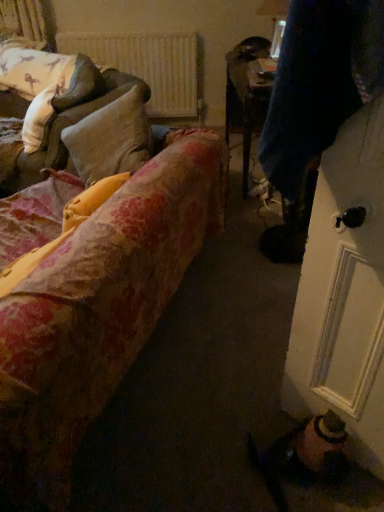
Question: From the image's perspective, would you say velvet dark blue coat at right is positioned over floral fabric couch at left, the first studio couch positioned from the back?

Choices:
 (A) no
 (B) yes

Answer: (B)

Question: Is velvet dark blue coat at right positioned in front of floral fabric couch at left, the first studio couch positioned from the back?

Choices:
 (A) no
 (B) yes

Answer: (B)

Question: Is velvet dark blue coat at right to the right of floral fabric couch at left, the 2th studio couch viewed from the front, from the viewer's perspective?

Choices:
 (A) no
 (B) yes

Answer: (B)

Question: From a real-world perspective, is velvet dark blue coat at right located beneath floral fabric couch at left, the 2th studio couch viewed from the front?

Choices:
 (A) no
 (B) yes

Answer: (B)

Question: Is velvet dark blue coat at right facing away from floral fabric couch at left, the first studio couch positioned from the back?

Choices:
 (A) yes
 (B) no

Answer: (B)

Question: Visually, is white soft pillow at upper left positioned to the left or to the right of floral fabric couch at left, the first studio couch positioned from the back?

Choices:
 (A) left
 (B) right

Answer: (A)

Question: From a real-world perspective, relative to floral fabric couch at left, the 2th studio couch viewed from the front, is white soft pillow at upper left vertically above or below?

Choices:
 (A) above
 (B) below

Answer: (A)

Question: From their relative heights in the image, would you say white soft pillow at upper left is taller or shorter than floral fabric couch at left, the first studio couch positioned from the back?

Choices:
 (A) short
 (B) tall

Answer: (A)

Question: Would you say white soft pillow at upper left is inside or outside floral fabric couch at left, the first studio couch positioned from the back?

Choices:
 (A) outside
 (B) inside

Answer: (A)

Question: Based on their sizes in the image, would you say velvet dark blue coat at right is bigger or smaller than floral fabric couch at left, acting as the second studio couch starting from the back?

Choices:
 (A) small
 (B) big

Answer: (A)

Question: In the image, is velvet dark blue coat at right positioned in front of or behind floral fabric couch at left, acting as the second studio couch starting from the back?

Choices:
 (A) front
 (B) behind

Answer: (B)

Question: Considering the positions of velvet dark blue coat at right and floral fabric couch at left, acting as the second studio couch starting from the back, in the image, is velvet dark blue coat at right taller or shorter than floral fabric couch at left, acting as the second studio couch starting from the back,?

Choices:
 (A) short
 (B) tall

Answer: (B)

Question: Is point (284, 261) positioned closer to the camera than point (205, 206)?

Choices:
 (A) closer
 (B) farther

Answer: (B)

Question: From a real-world perspective, relative to white textured radiator at upper center, is velvet dark blue coat at right vertically above or below?

Choices:
 (A) above
 (B) below

Answer: (A)

Question: Is velvet dark blue coat at right bigger or smaller than white textured radiator at upper center?

Choices:
 (A) big
 (B) small

Answer: (A)